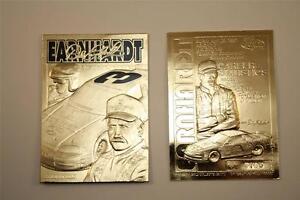
This screenshot has height=200, width=300. What are the coordinates of `tan table` in the screenshot? It's located at (80, 18), (26, 146).